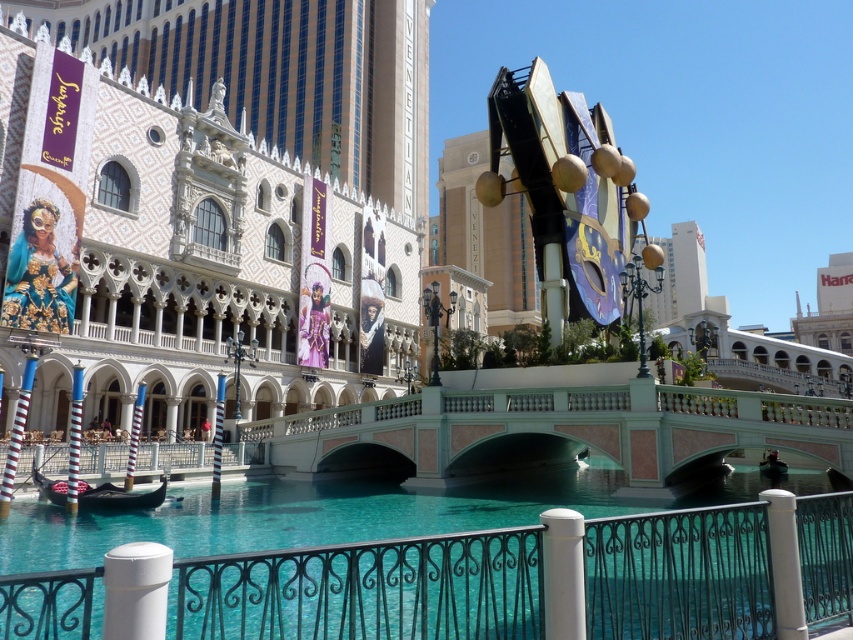
Is clear glass canal at center further to the viewer compared to wooden gondola at lower left?

No.

Between clear glass canal at center and wooden gondola at lower left, which one is positioned higher?

Positioned higher is clear glass canal at center.

Which is in front, point (32, 582) or point (111, 486)?

Point (32, 582) is more forward.

Where is `clear glass canal at center`? The width and height of the screenshot is (853, 640). clear glass canal at center is located at coordinates (x=367, y=589).

Is point (59, 307) closer to viewer compared to point (48, 477)?

No, (59, 307) is behind (48, 477).

Between white glossy building at upper left and wooden gondola at lower left, which one appears on the right side from the viewer's perspective?

wooden gondola at lower left is more to the right.

Who is more distant from viewer, (90, 54) or (39, 480)?

Point (90, 54)

Where is `white glossy building at upper left`? white glossy building at upper left is located at coordinates (212, 202).

Is point (228, 573) less distant than point (567, 436)?

Yes, it is in front of point (567, 436).

Between point (416, 568) and point (608, 385), which one is positioned behind?

The point (608, 385) is more distant.

In order to click on clear glass canal at center in this screenshot , I will do `click(367, 589)`.

Where is `clear glass canal at center`? This screenshot has width=853, height=640. clear glass canal at center is located at coordinates (367, 589).